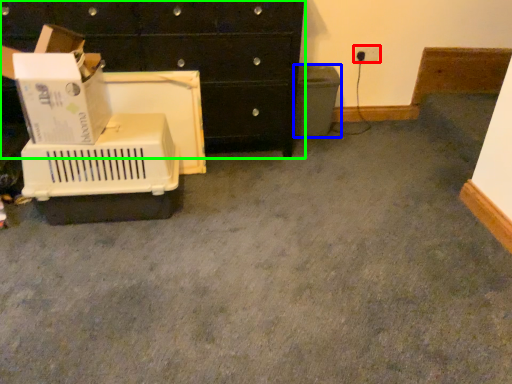
Question: Which is farther away from electric outlet (highlighted by a red box)? recycling bin (highlighted by a blue box) or chest of drawers (highlighted by a green box)?

Choices:
 (A) recycling bin
 (B) chest of drawers

Answer: (B)